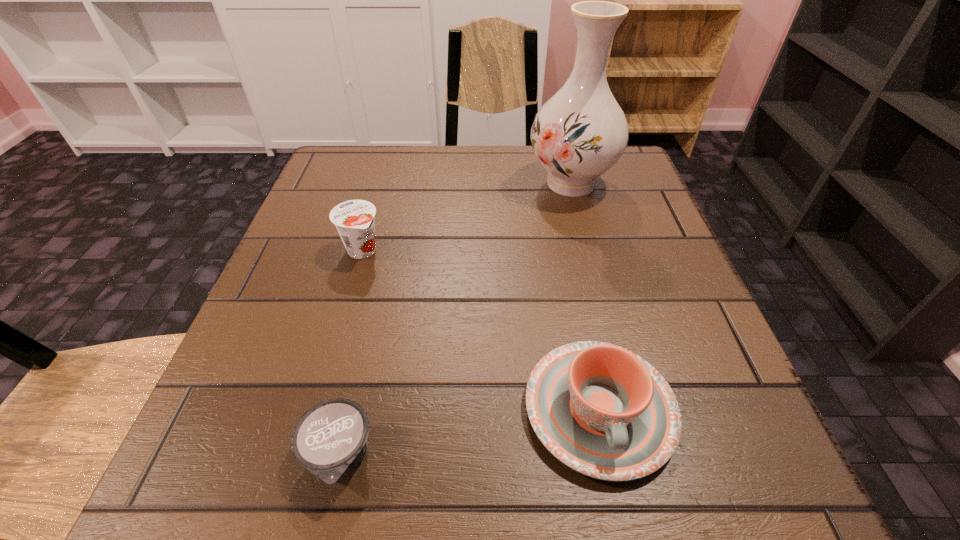
Where is `vacant area that lies between the chinaware and the farthest object`? The image size is (960, 540). vacant area that lies between the chinaware and the farthest object is located at coordinates (585, 296).

You are a GUI agent. You are given a task and a screenshot of the screen. Output one action in this format:
    pyautogui.click(x=<x>, y=<y>)
    Task: Click on the free area in between the nearer yogurt and the tallest object
    
    Given the screenshot: What is the action you would take?
    pyautogui.click(x=455, y=320)

Locate an element on the screen. This screenshot has width=960, height=540. empty space that is in between the chinaware and the nearer yogurt is located at coordinates (469, 433).

Point out which object is positioned as the second nearest to the tallest object. Please provide its 2D coordinates. Your answer should be formatted as a tuple, i.e. [(x, y)], where the tuple contains the x and y coordinates of a point satisfying the conditions above.

[(603, 411)]

The height and width of the screenshot is (540, 960). Find the location of `object that stands as the second closest to the vase`. object that stands as the second closest to the vase is located at coordinates (603, 411).

I want to click on free spot that satisfies the following two spatial constraints: 1. on the front side of the second farthest object; 2. on the right side of the shortest object, so point(302,457).